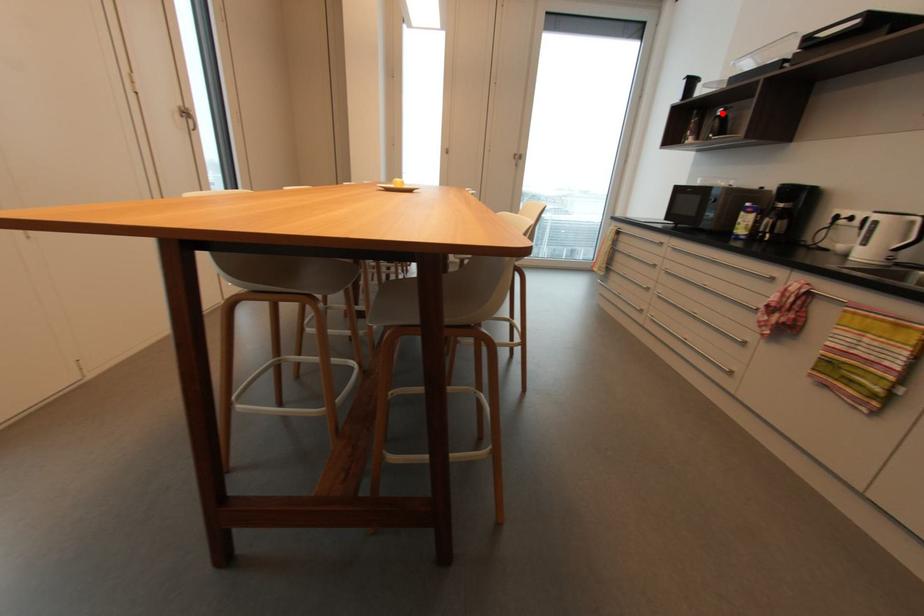
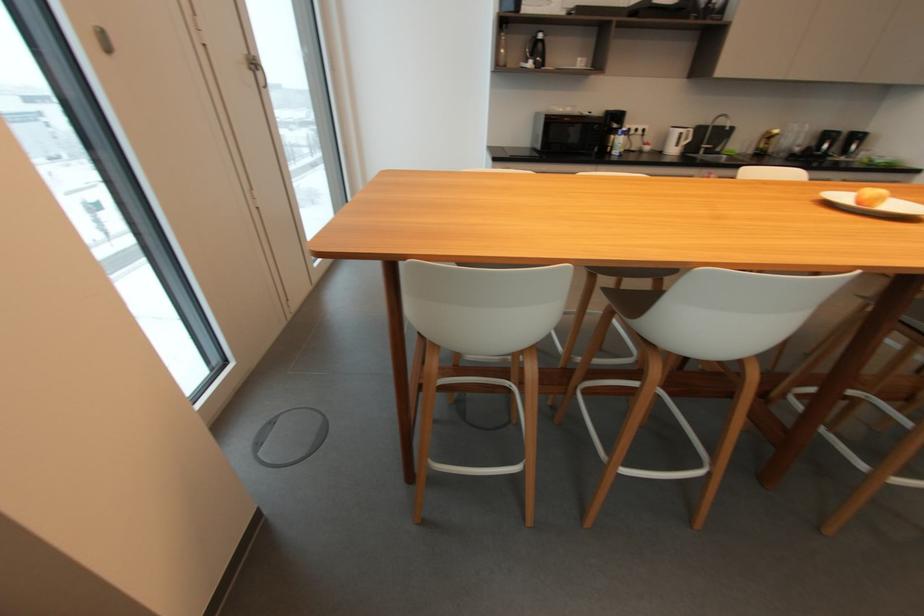
Find the pixel in the second image that matches the highlighted location in the first image.

(544, 36)